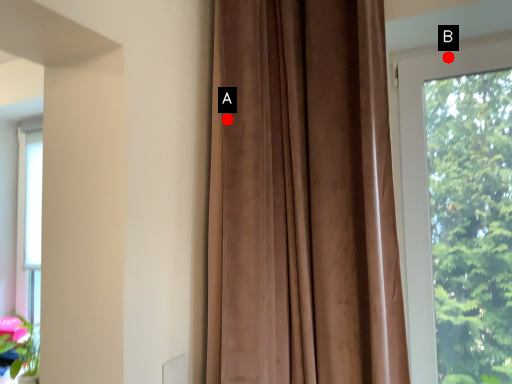
Question: Two points are circled on the image, labeled by A and B beside each circle. Which point is closer to the camera?

Choices:
 (A) A is closer
 (B) B is closer

Answer: (A)